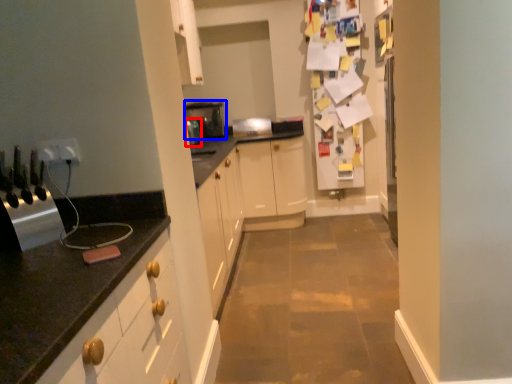
Question: Which object appears closest to the camera in this image, appliance (highlighted by a red box) or appliance (highlighted by a blue box)?

Choices:
 (A) appliance
 (B) appliance

Answer: (A)